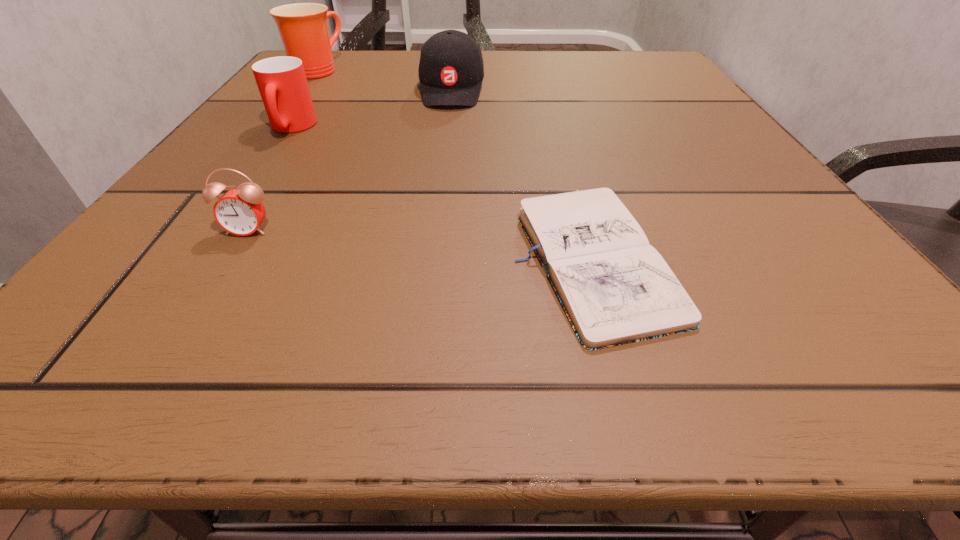
You are a GUI agent. You are given a task and a screenshot of the screen. Output one action in this format:
    pyautogui.click(x=<x>, y=<y>)
    Task: Click on the taller cup
    
    Given the screenshot: What is the action you would take?
    pyautogui.click(x=303, y=28)

This screenshot has width=960, height=540. What are the coordinates of `the tallest object` in the screenshot? It's located at (303, 28).

Where is `baseball cap`? The height and width of the screenshot is (540, 960). baseball cap is located at coordinates (451, 70).

I want to click on the third farthest object, so click(x=282, y=83).

The image size is (960, 540). I want to click on the shorter cup, so click(282, 83).

The image size is (960, 540). Find the location of `the fourth tallest object`. the fourth tallest object is located at coordinates (240, 211).

This screenshot has width=960, height=540. What are the coordinates of `the shortest object` in the screenshot? It's located at (615, 288).

Where is `notebook`? notebook is located at coordinates (615, 288).

The width and height of the screenshot is (960, 540). I want to click on vacant area situated on the right of the taller cup, so click(510, 70).

Image resolution: width=960 pixels, height=540 pixels. What are the coordinates of `free space located 0.210m with a logo on the front of the baseball cap` in the screenshot? It's located at (442, 170).